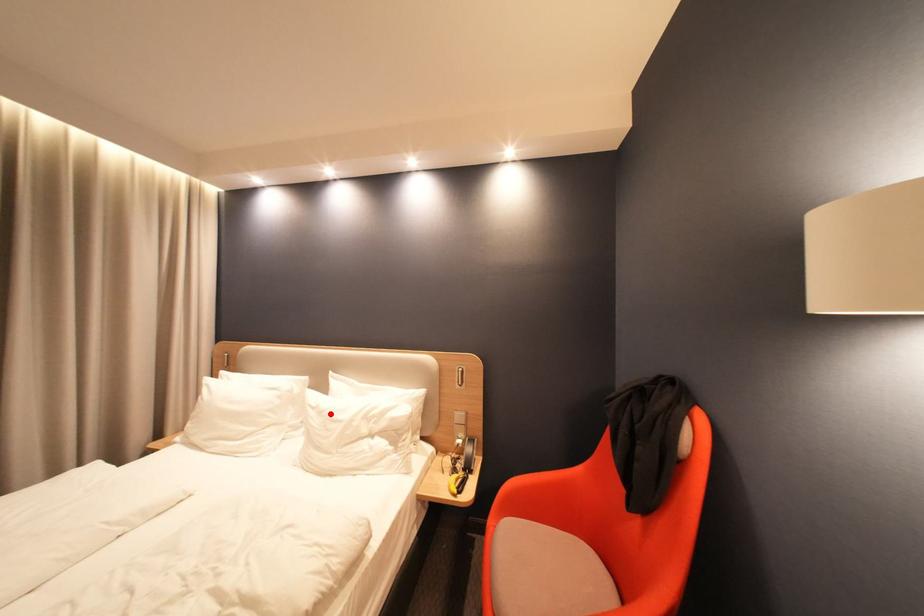
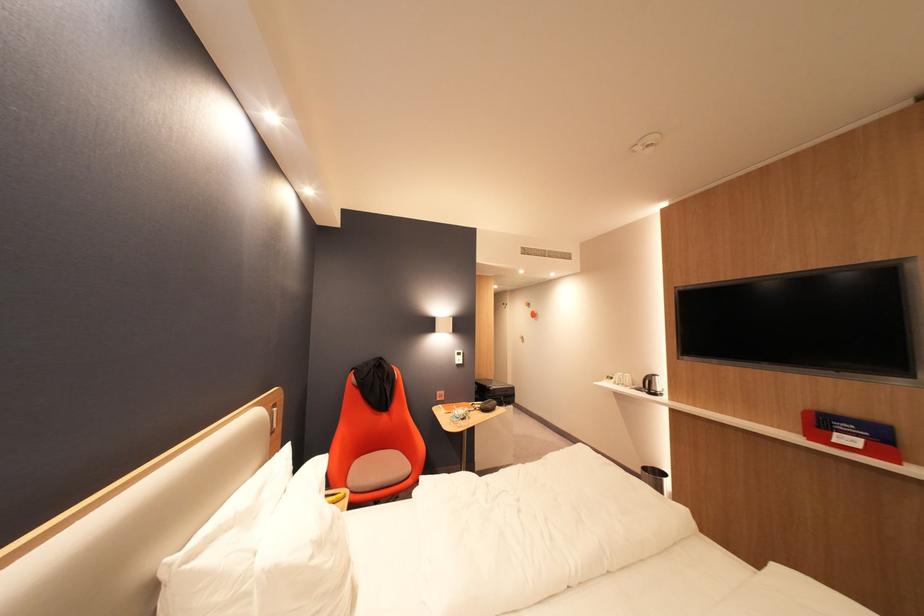
Question: A red point is marked in image1. In image2, is the corresponding 3D point closer to the camera or farther? Reply with the corresponding letter.

Choices:
 (A) The corresponding 3D point is closer.
 (B) The corresponding 3D point is farther.

Answer: (A)